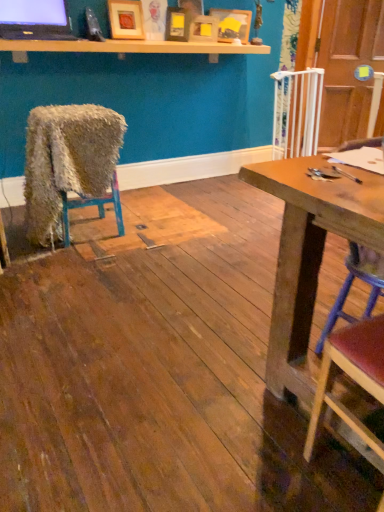
Where is `free space in front of wooden picture frame at upper center, arranged as the third picture frame when viewed from the left`? Image resolution: width=384 pixels, height=512 pixels. free space in front of wooden picture frame at upper center, arranged as the third picture frame when viewed from the left is located at coordinates (195, 47).